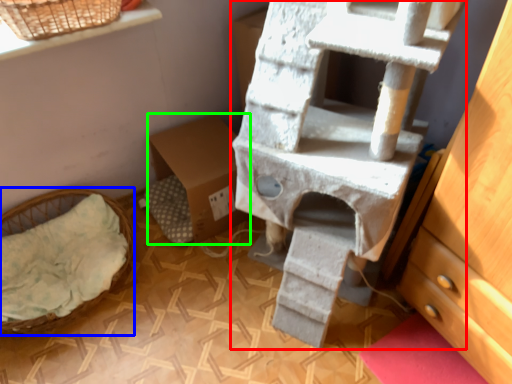
Question: Which object is the farthest from bunk bed (highlighted by a red box)? Choose among these: furniture (highlighted by a blue box) or cardboard box (highlighted by a green box).

Choices:
 (A) furniture
 (B) cardboard box

Answer: (A)